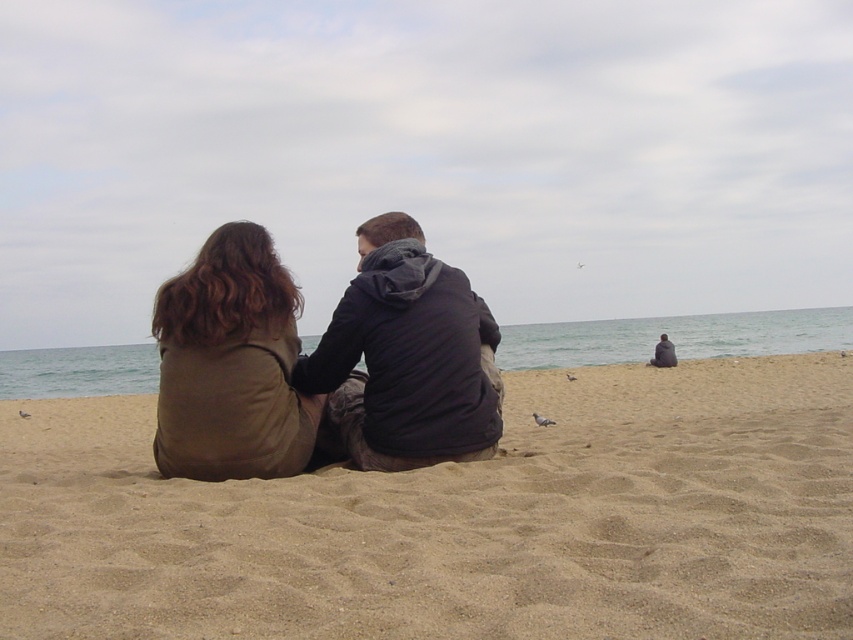
You are planning to build a small sandcastle on the beige sandy beach at center. Considering the presence of the gray matte pigeon at center, is there enough space to construct it without disturbing the pigeon?

The beige sandy beach at center is wider than the gray matte pigeon at center, so there is sufficient space to build the sandcastle without disturbing the pigeon.

You are standing at the center of the beach and want to find the dark gray hoodie at lower right. Based on the coordinates provided, in which direction should you move to locate it?

The dark gray hoodie at lower right is located at coordinates point (663,353), which means it is positioned to the right and slightly forward from your current position at the center. Move towards the lower right direction to find it.